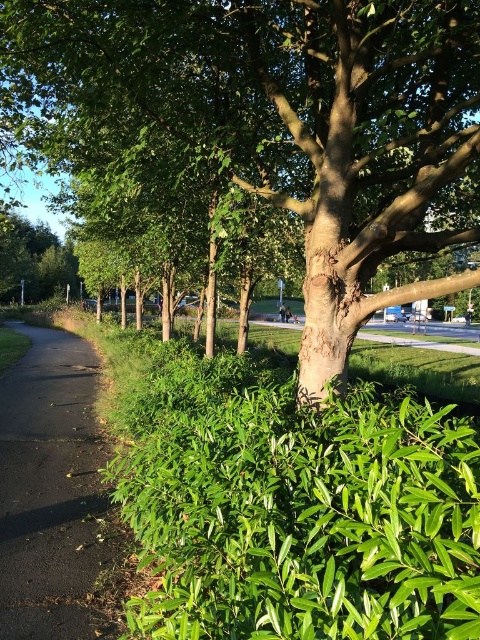
In order to click on green bark tree at center in this screenshot , I will do `click(295, 124)`.

Which of these two, green bark tree at center or black asphalt path at left, stands shorter?

black asphalt path at left

At what (x,y) coordinates should I click in order to perform the action: click on green bark tree at center. Please return your answer as a coordinate pair (x, y). Image resolution: width=480 pixels, height=640 pixels. Looking at the image, I should click on (295, 124).